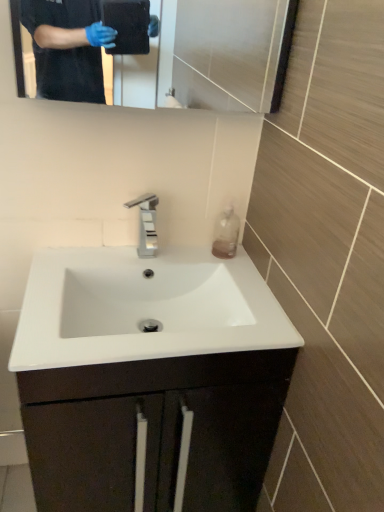
Question: From the image's perspective, does white glossy sink at center appear higher than translucent plastic bottle at right?

Choices:
 (A) no
 (B) yes

Answer: (A)

Question: Is white glossy sink at center positioned in front of translucent plastic bottle at right?

Choices:
 (A) no
 (B) yes

Answer: (B)

Question: From a real-world perspective, is white glossy sink at center over translucent plastic bottle at right?

Choices:
 (A) yes
 (B) no

Answer: (B)

Question: Can you confirm if white glossy sink at center is taller than translucent plastic bottle at right?

Choices:
 (A) no
 (B) yes

Answer: (B)

Question: Is white glossy sink at center positioned behind translucent plastic bottle at right?

Choices:
 (A) yes
 (B) no

Answer: (B)

Question: Is white glossy sink at center to the right of translucent plastic bottle at right from the viewer's perspective?

Choices:
 (A) no
 (B) yes

Answer: (A)

Question: From the image's perspective, does white glossy sink at center appear higher than glossy metallic mirror at upper center?

Choices:
 (A) no
 (B) yes

Answer: (A)

Question: Is white glossy sink at center oriented towards glossy metallic mirror at upper center?

Choices:
 (A) no
 (B) yes

Answer: (A)

Question: Is white glossy sink at center looking in the opposite direction of glossy metallic mirror at upper center?

Choices:
 (A) yes
 (B) no

Answer: (B)

Question: Can you confirm if white glossy sink at center is positioned to the left of glossy metallic mirror at upper center?

Choices:
 (A) no
 (B) yes

Answer: (B)

Question: Considering the relative sizes of white glossy sink at center and glossy metallic mirror at upper center in the image provided, is white glossy sink at center smaller than glossy metallic mirror at upper center?

Choices:
 (A) yes
 (B) no

Answer: (B)

Question: Is white glossy sink at center taller than glossy metallic mirror at upper center?

Choices:
 (A) yes
 (B) no

Answer: (B)

Question: Is glossy metallic mirror at upper center oriented towards translucent plastic bottle at right?

Choices:
 (A) yes
 (B) no

Answer: (B)